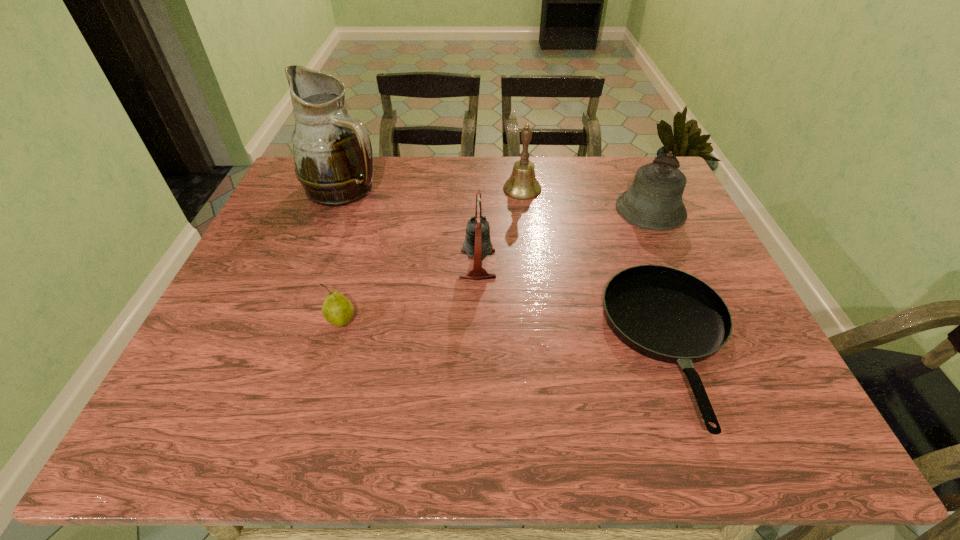
I want to click on empty space between the pitcher and the leftmost bell, so click(x=412, y=226).

The width and height of the screenshot is (960, 540). In order to click on free space between the tallest object and the rightmost bell in this screenshot , I will do `click(498, 199)`.

Identify the location of free space between the shortest object and the pear. The height and width of the screenshot is (540, 960). (507, 334).

Image resolution: width=960 pixels, height=540 pixels. I want to click on vacant space that is in between the second bell from right to left and the rightmost bell, so click(587, 199).

Select which object is the third closest to the nearest bell. Please provide its 2D coordinates. Your answer should be formatted as a tuple, i.e. [(x, y)], where the tuple contains the x and y coordinates of a point satisfying the conditions above.

[(337, 309)]

Identify which object is the closest to the rightmost bell. Please provide its 2D coordinates. Your answer should be formatted as a tuple, i.e. [(x, y)], where the tuple contains the x and y coordinates of a point satisfying the conditions above.

[(666, 314)]

Locate which bell ranks second in proximity to the second bell from right to left. Please provide its 2D coordinates. Your answer should be formatted as a tuple, i.e. [(x, y)], where the tuple contains the x and y coordinates of a point satisfying the conditions above.

[(477, 244)]

Identify which bell is located as the third nearest to the pear. Please provide its 2D coordinates. Your answer should be formatted as a tuple, i.e. [(x, y)], where the tuple contains the x and y coordinates of a point satisfying the conditions above.

[(654, 201)]

At what (x,y) coordinates should I click in order to perform the action: click on vacant space that satisfies the following two spatial constraints: 1. from the spout of the pear; 2. on the left side of the tallest object. Please return your answer as a coordinate pair (x, y). This screenshot has width=960, height=540. Looking at the image, I should click on (295, 322).

You are a GUI agent. You are given a task and a screenshot of the screen. Output one action in this format:
    pyautogui.click(x=<x>, y=<y>)
    Task: Click on the free space that satisfies the following two spatial constraints: 1. from the spout of the rightmost bell; 2. on the right side of the pitcher
    The height and width of the screenshot is (540, 960).
    Given the screenshot: What is the action you would take?
    pyautogui.click(x=337, y=210)